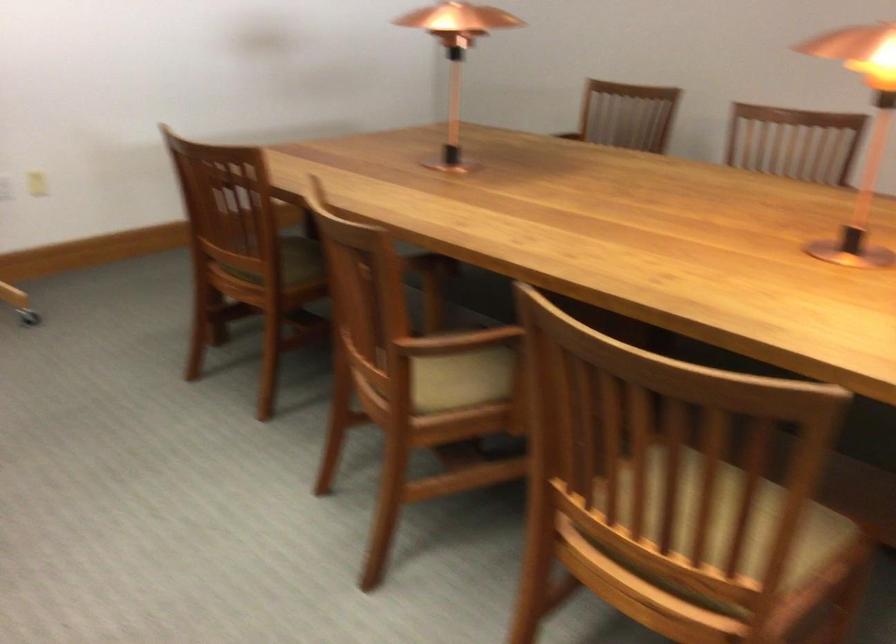
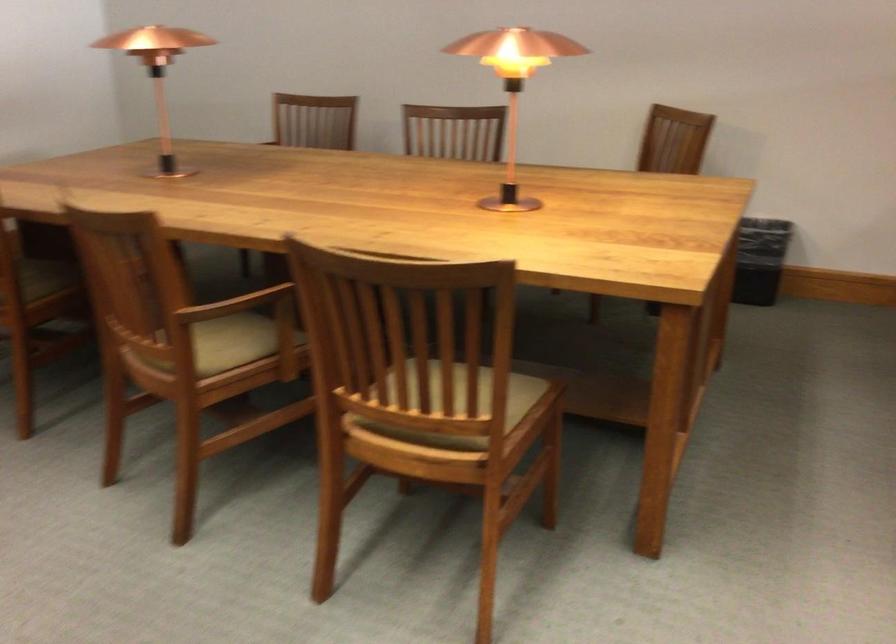
Locate, in the second image, the point that corresponds to pixel 711 554 in the first image.

(460, 404)